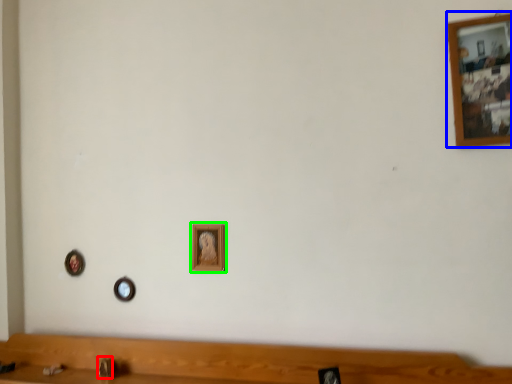
Question: Which object is the closest to the faucet (highlighted by a red box)? Choose among these: picture frame (highlighted by a blue box) or picture frame (highlighted by a green box).

Choices:
 (A) picture frame
 (B) picture frame

Answer: (B)